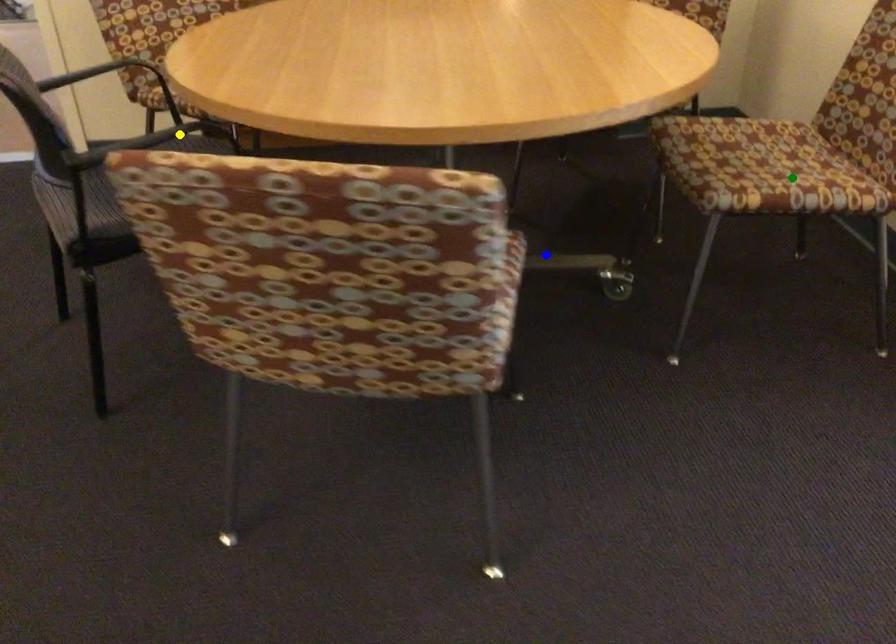
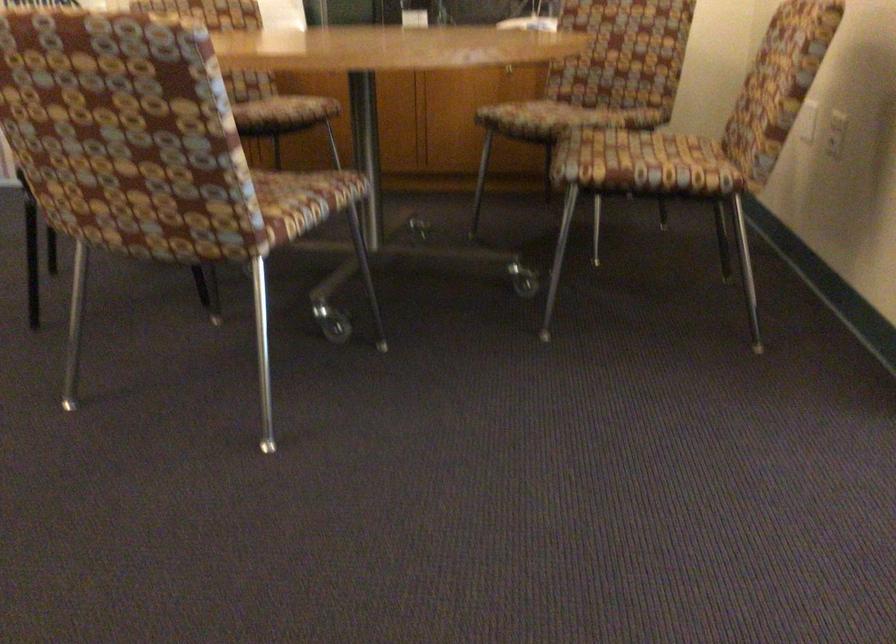
I am providing you with two images of the same scene from different viewpoints. Three points are marked in image1. Which point corresponds to a part or object that is occluded in image2?In image1, three points are marked. Which of them correspond to a part or object that is occluded in image2?Among the three points shown in image1, which one corresponds to a part or object that is no longer visible due to occlusion in image2?

blue point, yellow point